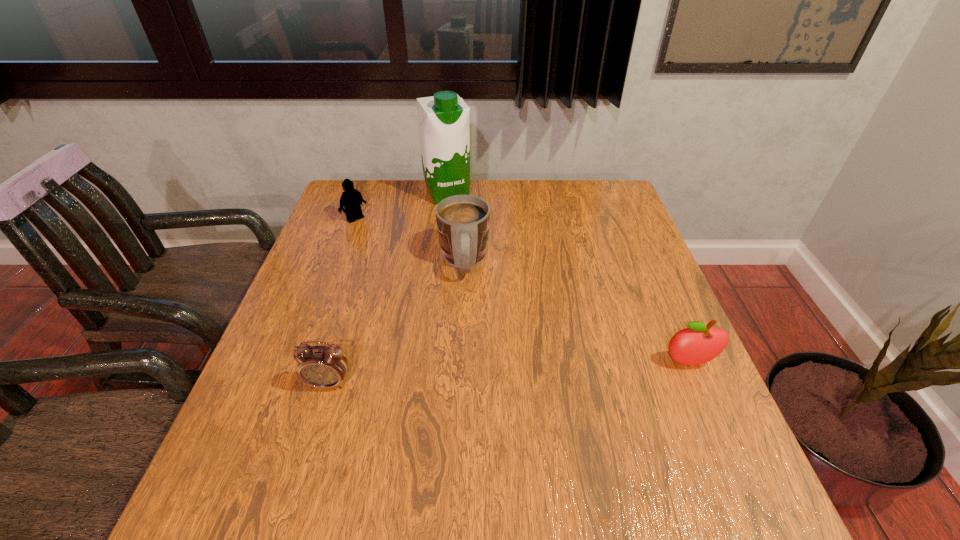
The width and height of the screenshot is (960, 540). In order to click on alarm clock that is at the left edge in this screenshot , I will do `click(325, 367)`.

Locate an element on the screen. This screenshot has width=960, height=540. Lego positioned at the left edge is located at coordinates (351, 199).

Where is `object present at the right edge`? Image resolution: width=960 pixels, height=540 pixels. object present at the right edge is located at coordinates (700, 343).

Identify the location of object at the far left corner. The height and width of the screenshot is (540, 960). (351, 199).

Identify the location of vacant space at the far edge of the desktop. Image resolution: width=960 pixels, height=540 pixels. (551, 181).

In the image, there is a desktop. Identify the location of free space at the near edge. The height and width of the screenshot is (540, 960). (532, 417).

Locate an element on the screen. free space at the left edge of the desktop is located at coordinates (374, 239).

At what (x,y) coordinates should I click in order to perform the action: click on vacant space at the right edge of the desktop. Please return your answer as a coordinate pair (x, y). Looking at the image, I should click on (715, 406).

In the image, there is a desktop. In order to click on vacant area at the far left corner in this screenshot , I will do `click(367, 201)`.

Identify the location of blank space at the far right corner of the desktop. (577, 194).